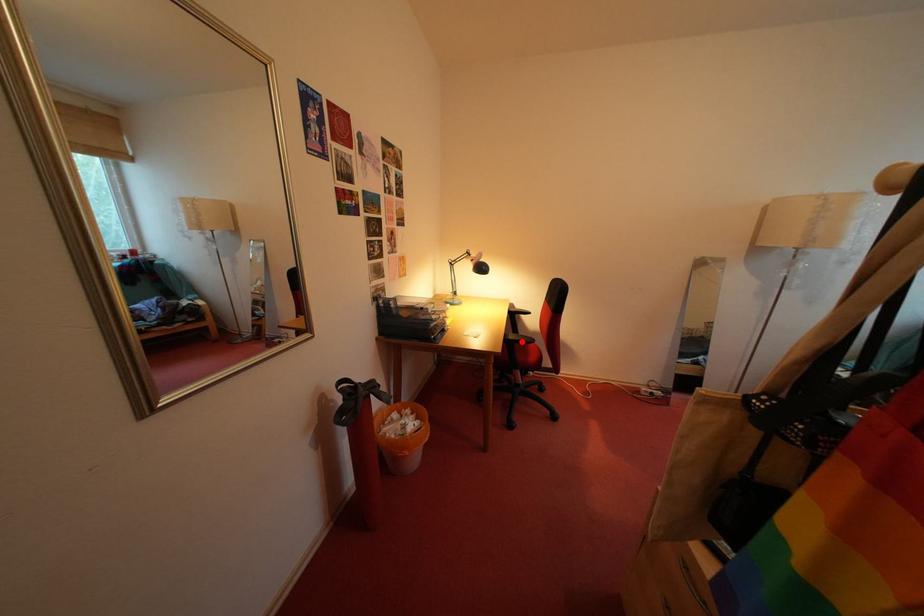
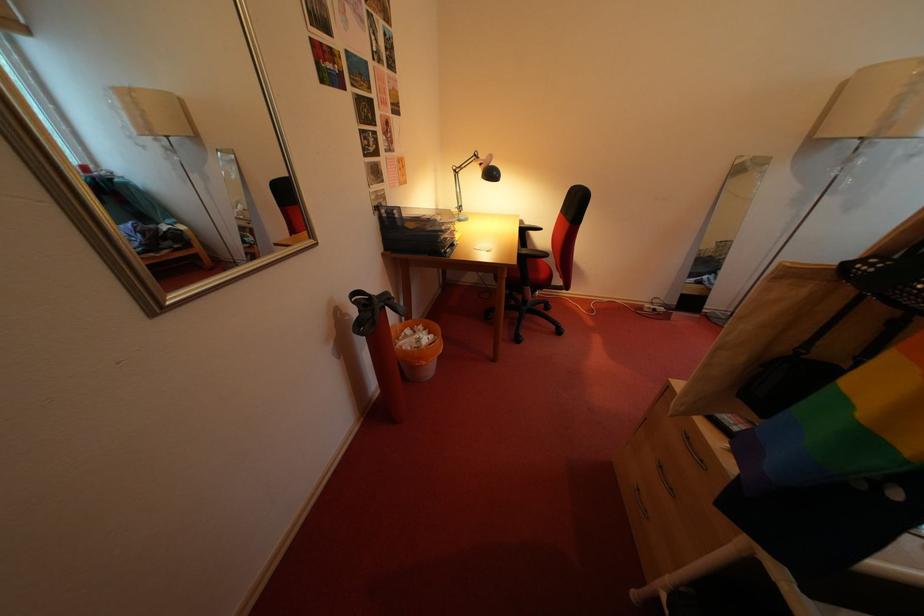
Find the pixel in the second image that matches the highlighted location in the first image.

(535, 257)